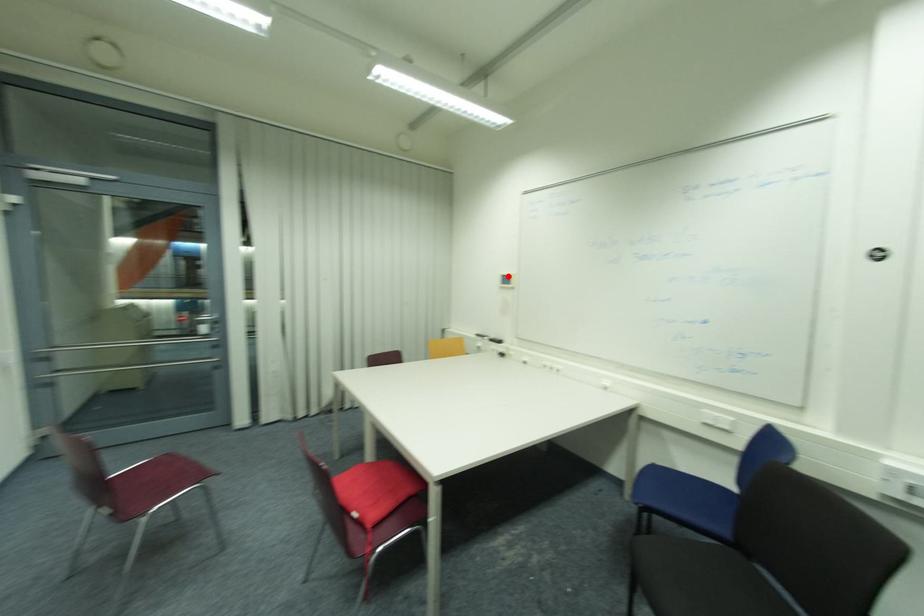
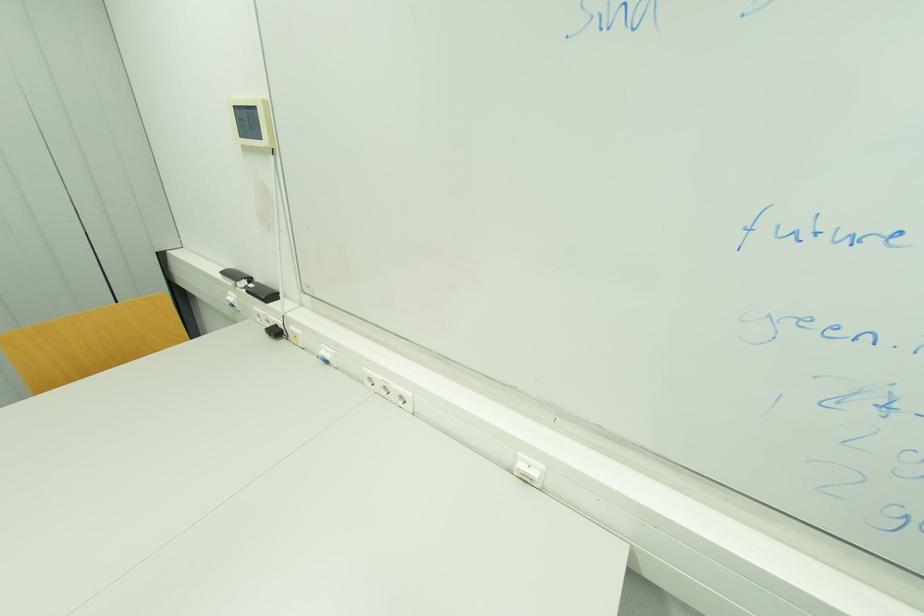
Question: I am providing you with two images of the same scene from different viewpoints. A red point is marked on the first image. Is the red point's position out of view in image 2?

Choices:
 (A) Yes
 (B) No

Answer: (B)